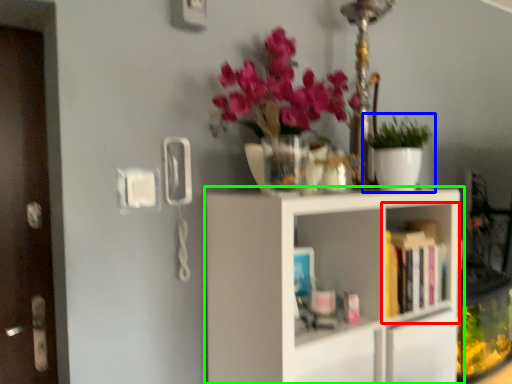
Question: Estimate the real-world distances between objects in this image. Which object is closer to shelf (highlighted by a red box), houseplant (highlighted by a blue box) or shelf (highlighted by a green box)?

Choices:
 (A) houseplant
 (B) shelf

Answer: (B)